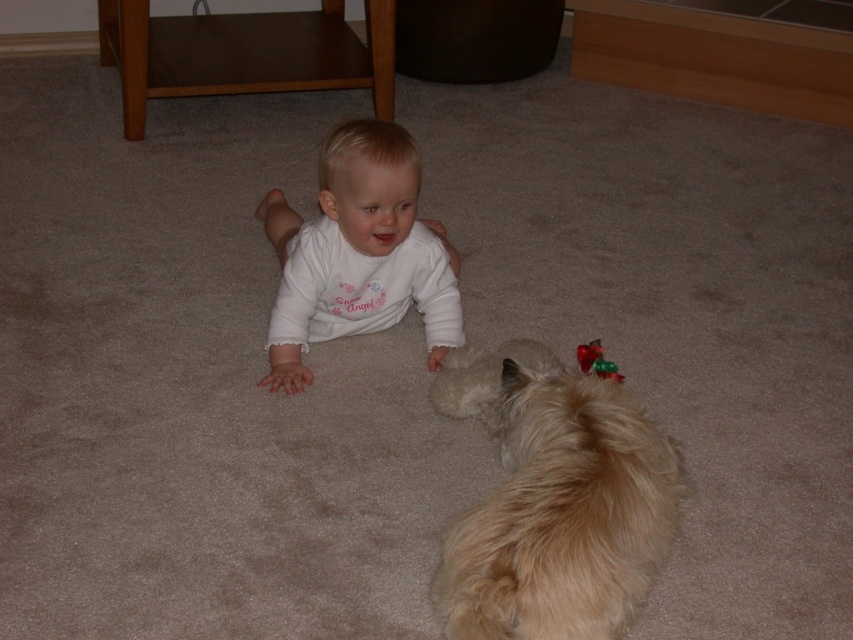
You are a parent in the living room. You see the white soft baby at center and the shiny red plastic toy at lower right. Which object is closer to the left side of the room?

The white soft baby at center is closer to the left side of the room because it is positioned to the left of the shiny red plastic toy at lower right.

In the scene shown: You are a parent trying to retrieve the shiny red plastic toy at lower right from the fluffy golden fur dog at lower right. Based on their positions, can you easily reach the toy without moving the dog?

The fluffy golden fur dog at lower right is in front of the shiny red plastic toy at lower right, so the dog is blocking access to the toy. You would need to move the dog to reach the toy.

You are a parent trying to locate your dog in the living room. You see the baby lying on the carpet and notice a point at coordinates (x=561, y=513). What object is located at that point?

The point at coordinates (x=561, y=513) corresponds to the fluffy golden fur dog at lower right.